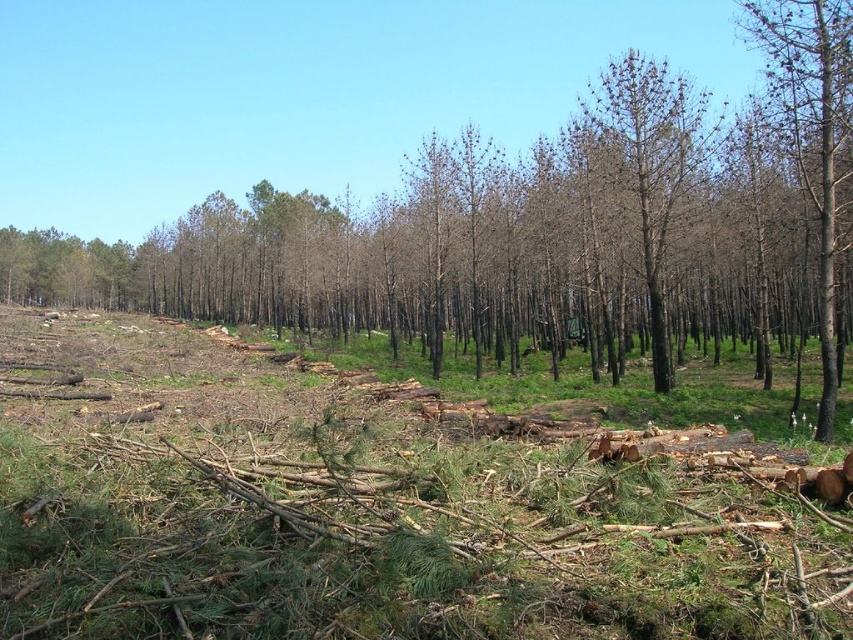
Question: Is brown wood tree at center positioned before brown bark tree at center?

Choices:
 (A) yes
 (B) no

Answer: (A)

Question: Which of the following is the closest to the observer?

Choices:
 (A) (828, 145)
 (B) (822, 81)

Answer: (A)

Question: Does brown wood tree at center lie behind brown bark tree at center?

Choices:
 (A) no
 (B) yes

Answer: (A)

Question: Estimate the real-world distances between objects in this image. Which object is farther from the brown bark tree at center?

Choices:
 (A) brown bark tree at right
 (B) brown wood tree at center

Answer: (B)

Question: Which point appears closest to the camera in this image?

Choices:
 (A) (808, 161)
 (B) (401, 196)

Answer: (A)

Question: Does brown bark tree at right lie in front of brown bark tree at center?

Choices:
 (A) yes
 (B) no

Answer: (A)